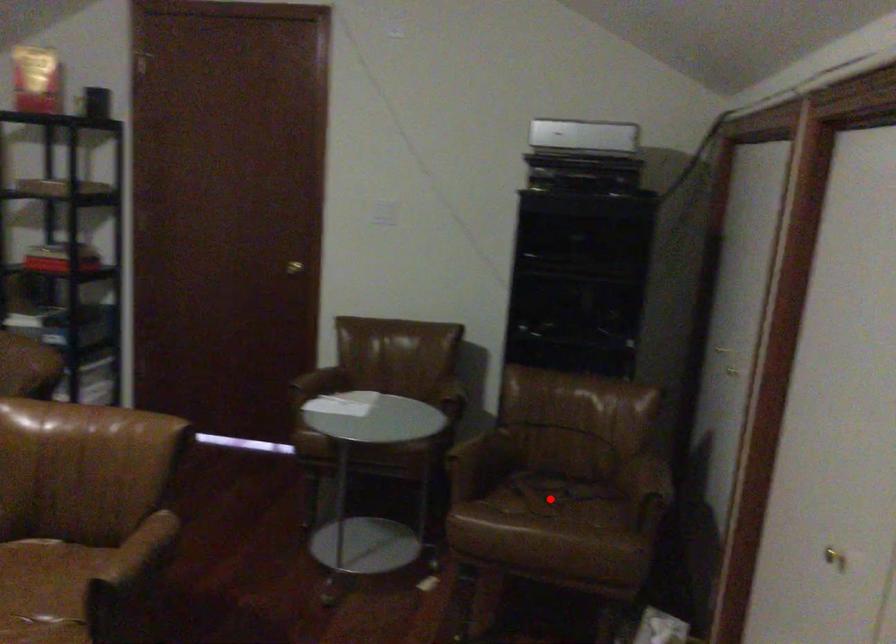
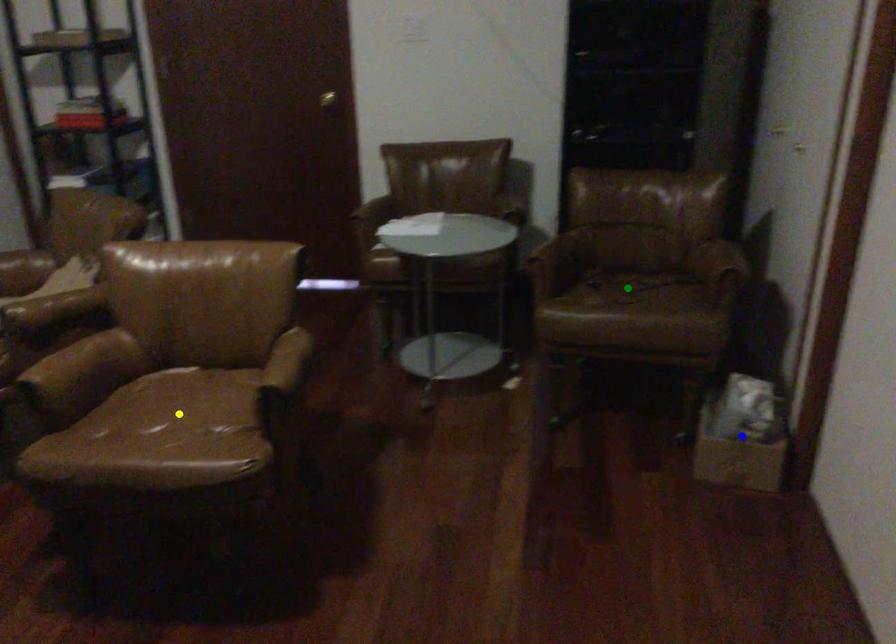
Question: I am providing you with two images of the same scene from different viewpoints. A red point is marked on the first image. You are given multiple points on the second image. Can you choose the point in image 2 that corresponds to the point in image 1?

Choices:
 (A) blue point
 (B) green point
 (C) yellow point

Answer: (B)